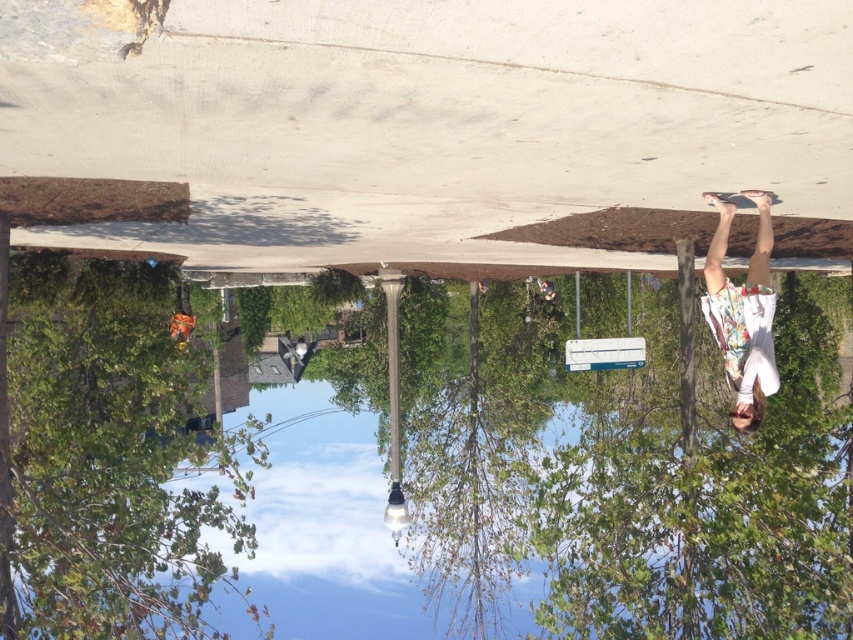
Does green leafy tree at lower left have a lesser width compared to floral-patterned shirt at right?

Indeed, green leafy tree at lower left has a lesser width compared to floral-patterned shirt at right.

Between point (93, 577) and point (718, 225), which one is positioned in front?

Point (93, 577)

Find the location of a particular element. green leafy tree at lower left is located at coordinates (106, 454).